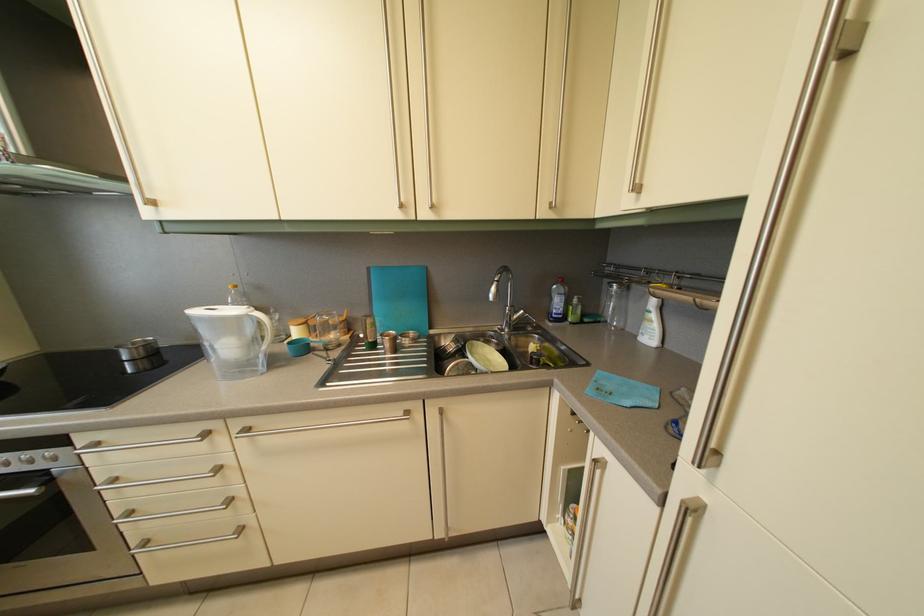
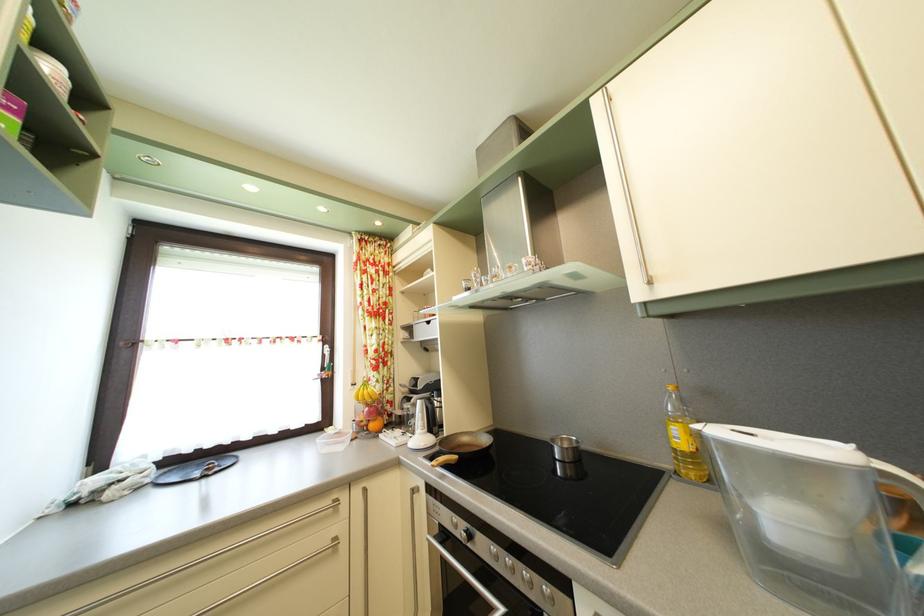
Based on the continuous images, in which direction is the camera rotating?

The rotation direction of the camera is left-up.